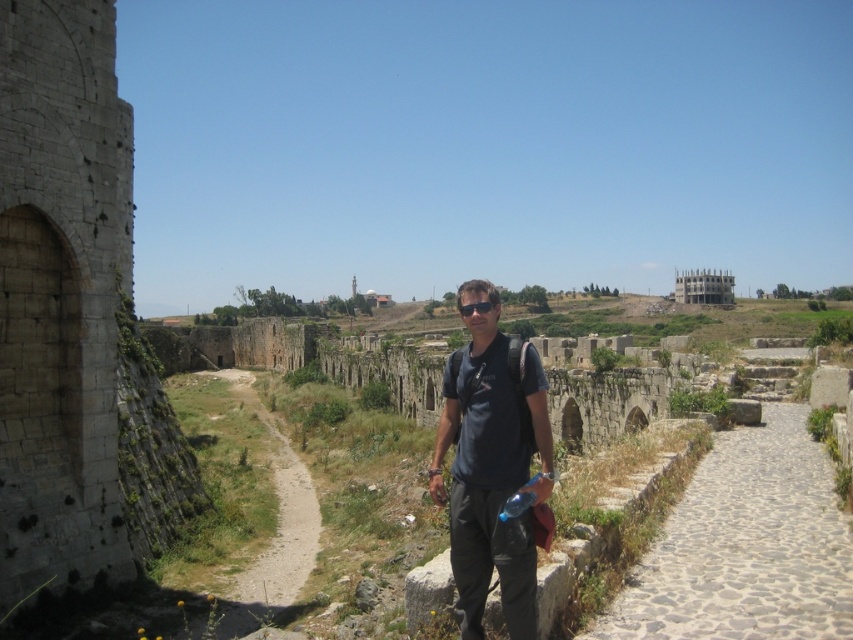
Question: Does stone archway at left appear on the left side of brown dirt path at center?

Choices:
 (A) no
 (B) yes

Answer: (A)

Question: Among these objects, which one is farthest from the camera?

Choices:
 (A) dark blue t-shirt at center
 (B) gray cobblestone path at center-right

Answer: (A)

Question: Does gray cobblestone path at center-right appear under dark blue t-shirt at center?

Choices:
 (A) yes
 (B) no

Answer: (A)

Question: Which point appears farthest from the camera in this image?

Choices:
 (A) (305, 541)
 (B) (44, 294)
 (C) (788, 445)
 (D) (529, 369)

Answer: (A)

Question: Is gray cobblestone path at center-right positioned in front of brown dirt path at center?

Choices:
 (A) yes
 (B) no

Answer: (A)

Question: Estimate the real-world distances between objects in this image. Which object is closer to the stone archway at left?

Choices:
 (A) dark blue t-shirt at center
 (B) brown dirt path at center

Answer: (B)